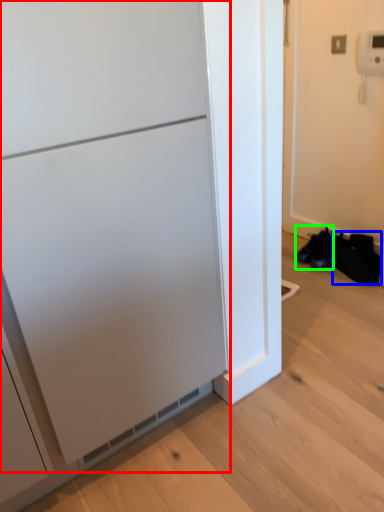
Question: Which object is positioned farthest from appliance (highlighted by a red box)? Select from shoe (highlighted by a blue box) and footwear (highlighted by a green box).

Choices:
 (A) shoe
 (B) footwear

Answer: (B)